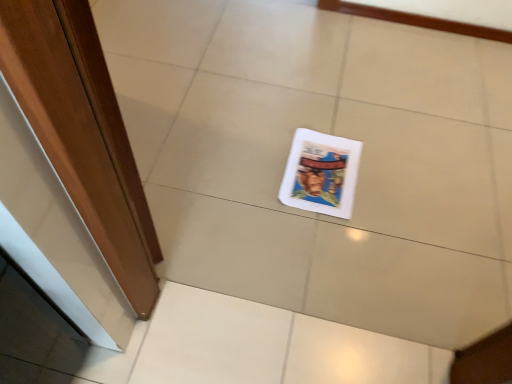
Question: Based on their sizes in the image, would you say wooden door at left is bigger or smaller than white glossy magazine at center?

Choices:
 (A) big
 (B) small

Answer: (A)

Question: Do you think wooden door at left is within white glossy magazine at center, or outside of it?

Choices:
 (A) outside
 (B) inside

Answer: (A)

Question: From the image's perspective, is wooden door at left located above or below white glossy magazine at center?

Choices:
 (A) above
 (B) below

Answer: (A)

Question: In the image, is white glossy magazine at center positioned in front of or behind wooden door at left?

Choices:
 (A) behind
 (B) front

Answer: (A)

Question: In terms of height, does white glossy magazine at center look taller or shorter compared to wooden door at left?

Choices:
 (A) short
 (B) tall

Answer: (A)

Question: Is white glossy magazine at center to the left or to the right of wooden door at left in the image?

Choices:
 (A) left
 (B) right

Answer: (B)

Question: Does point (309, 139) appear closer or farther from the camera than point (54, 160)?

Choices:
 (A) farther
 (B) closer

Answer: (A)